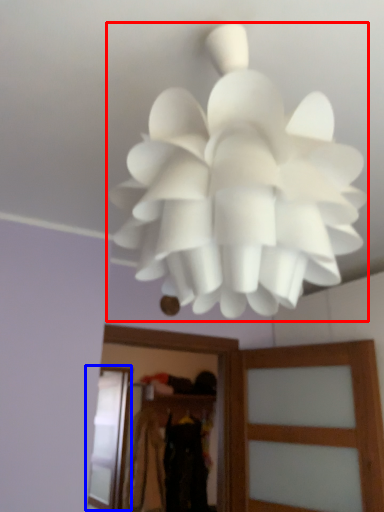
Question: Which object appears farthest to the camera in this image, lamp (highlighted by a red box) or screen door (highlighted by a blue box)?

Choices:
 (A) lamp
 (B) screen door

Answer: (B)